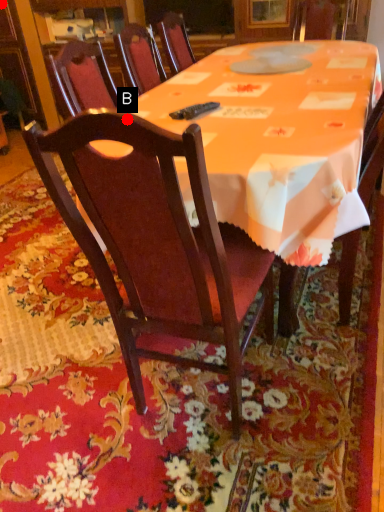
Question: Two points are circled on the image, labeled by A and B beside each circle. Which point is closer to the camera taking this photo?

Choices:
 (A) A is closer
 (B) B is closer

Answer: (B)